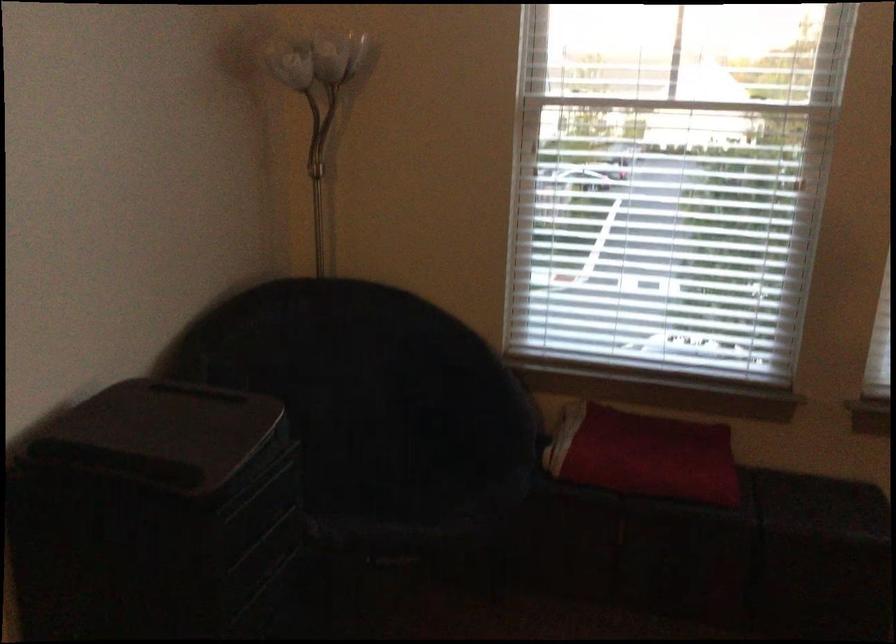
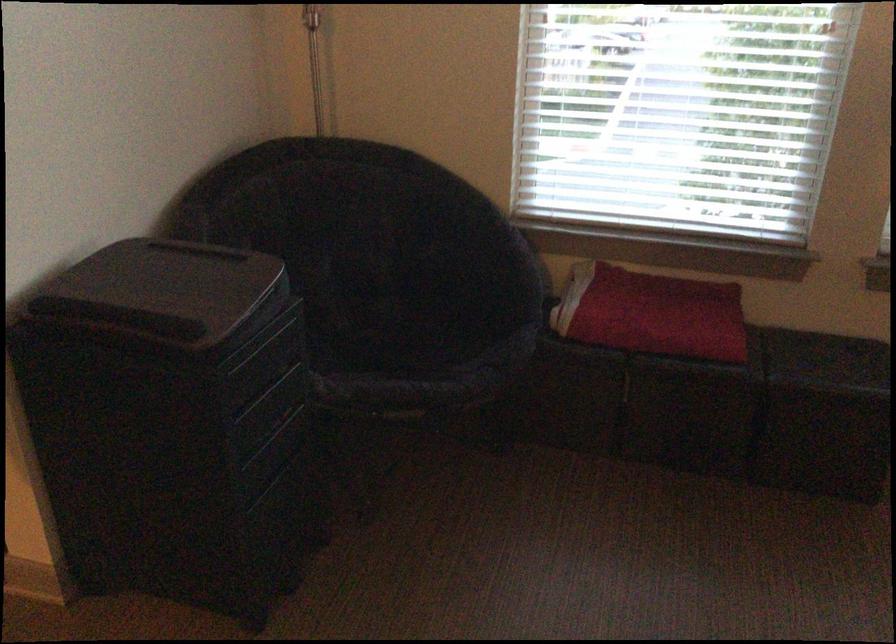
Where in the second image is the point corresponding to the point at 645,460 from the first image?

(651, 313)